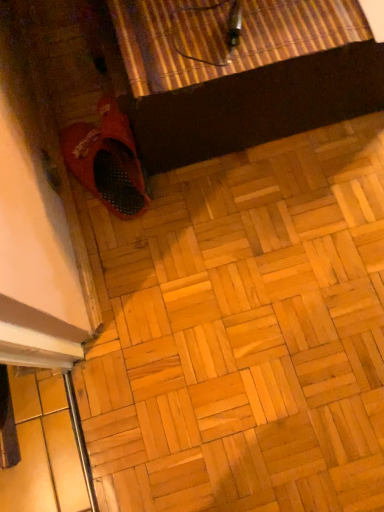
In order to face matte red shoe at lower left, should I rotate leftwards or rightwards?

A 11.716 degree turn to the left will do.

What do you see at coordinates (107, 160) in the screenshot? I see `matte red shoe at lower left` at bounding box center [107, 160].

This screenshot has width=384, height=512. Find the location of `matte red shoe at lower left`. matte red shoe at lower left is located at coordinates [x=107, y=160].

What do you see at coordinates (243, 333) in the screenshot? I see `matte black cat litter box at lower left` at bounding box center [243, 333].

Locate an element on the screen. matte black cat litter box at lower left is located at coordinates (243, 333).

Measure the distance between matte black cat litter box at lower left and camera.

matte black cat litter box at lower left and camera are 33.82 inches apart.

Where is `matte red shoe at lower left`? This screenshot has width=384, height=512. matte red shoe at lower left is located at coordinates (107, 160).

Considering the relative positions of matte black cat litter box at lower left and matte red shoe at lower left in the image provided, is matte black cat litter box at lower left to the right of matte red shoe at lower left from the viewer's perspective?

Yes.

Does matte black cat litter box at lower left lie in front of matte red shoe at lower left?

Yes.

Does point (283, 217) come farther from viewer compared to point (114, 130)?

Yes, point (283, 217) is behind point (114, 130).

From the image's perspective, is matte black cat litter box at lower left on top of matte red shoe at lower left?

No, from the image's perspective, matte black cat litter box at lower left is not on top of matte red shoe at lower left.

From a real-world perspective, between matte black cat litter box at lower left and matte red shoe at lower left, who is vertically lower?

From a 3D spatial view, matte black cat litter box at lower left is below.

Which of these two, matte black cat litter box at lower left or matte red shoe at lower left, is thinner?

matte red shoe at lower left is thinner.

Considering the sizes of objects matte black cat litter box at lower left and matte red shoe at lower left in the image provided, who is taller, matte black cat litter box at lower left or matte red shoe at lower left?

matte red shoe at lower left is taller.

Who is bigger, matte black cat litter box at lower left or matte red shoe at lower left?

With larger size is matte black cat litter box at lower left.

Does matte black cat litter box at lower left contain matte red shoe at lower left?

No, matte red shoe at lower left is not surrounded by matte black cat litter box at lower left.

Looking at this image, is matte black cat litter box at lower left placed right next to matte red shoe at lower left?

No, matte black cat litter box at lower left is not in contact with matte red shoe at lower left.

Is matte red shoe at lower left at the back of matte black cat litter box at lower left?

No, matte black cat litter box at lower left's orientation is not away from matte red shoe at lower left.

How many degrees apart are the facing directions of matte black cat litter box at lower left and matte red shoe at lower left?

They differ by 160 degrees in their facing directions.

What are the coordinates of `tile in front of the matte red shoe at lower left` in the screenshot? It's located at [x=243, y=333].

Is matte red shoe at lower left to the left of matte black cat litter box at lower left from the viewer's perspective?

Indeed, matte red shoe at lower left is positioned on the left side of matte black cat litter box at lower left.

From the picture: Is matte red shoe at lower left behind matte black cat litter box at lower left?

Yes, it is.

Which is nearer, (x=73, y=157) or (x=212, y=383)?

The point (x=212, y=383) is in front.

From the image's perspective, which object appears higher, matte red shoe at lower left or matte black cat litter box at lower left?

From the image's view, matte red shoe at lower left is above.

From a real-world perspective, is matte red shoe at lower left over matte black cat litter box at lower left?

Indeed, from a real-world perspective, matte red shoe at lower left stands above matte black cat litter box at lower left.

Which of these two, matte red shoe at lower left or matte black cat litter box at lower left, is wider?

With larger width is matte black cat litter box at lower left.

Considering the sizes of matte red shoe at lower left and matte black cat litter box at lower left in the image, is matte red shoe at lower left taller or shorter than matte black cat litter box at lower left?

In the image, matte red shoe at lower left appears to be taller than matte black cat litter box at lower left.

Looking at this image, between matte red shoe at lower left and matte black cat litter box at lower left, which one has smaller size?

With smaller size is matte red shoe at lower left.

Does matte red shoe at lower left contain matte black cat litter box at lower left?

No, matte black cat litter box at lower left is not inside matte red shoe at lower left.

Is matte red shoe at lower left directly adjacent to matte black cat litter box at lower left?

No, matte red shoe at lower left is not with matte black cat litter box at lower left.

Is matte red shoe at lower left facing away from matte black cat litter box at lower left?

No, matte red shoe at lower left's orientation is not away from matte black cat litter box at lower left.

Can you tell me how much matte red shoe at lower left and matte black cat litter box at lower left differ in facing direction?

There is a 160-degree angle between the facing directions of matte red shoe at lower left and matte black cat litter box at lower left.

This screenshot has width=384, height=512. I want to click on footwear above the matte black cat litter box at lower left (from a real-world perspective), so click(107, 160).

This screenshot has width=384, height=512. What are the coordinates of `tile to the right of matte red shoe at lower left` in the screenshot? It's located at (243, 333).

This screenshot has height=512, width=384. I want to click on tile below the matte red shoe at lower left (from the image's perspective), so point(243,333).